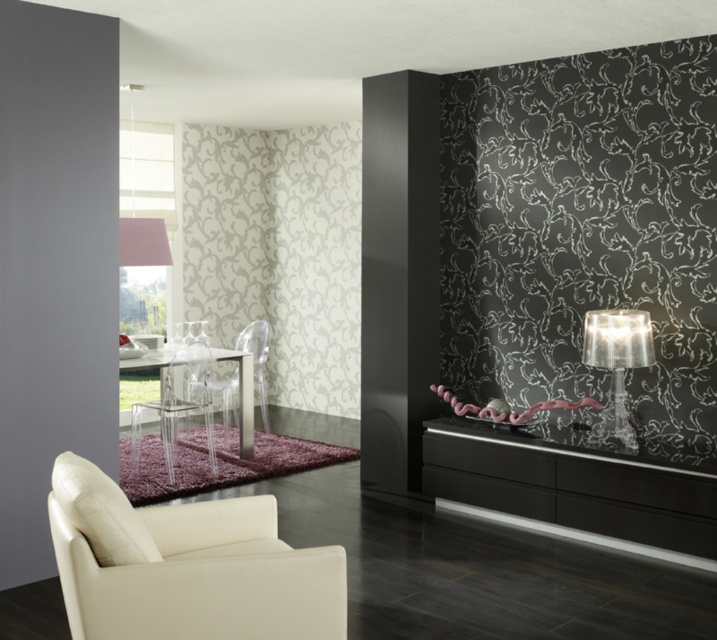
You are planning to place a new coffee table in the living room. The transparent plastic armchair at center and the white leather couch at lower left are in the way. Which furniture piece should you move first to create space for the coffee table, considering their sizes?

The transparent plastic armchair at center is bigger than the white leather couch at lower left, so you should move the transparent plastic armchair at center first to create enough space for the coffee table.

You are standing in the room and want to reach the white leather couch at lower left from your current position near the clear glass table lamp at right. Which direction should you move to get closer to the couch?

Since the clear glass table lamp at right is closer to the viewer than the white leather couch at lower left, you should move towards the left direction to approach the white leather couch at lower left.

You are a guest entering the room and need to choose a seat. The beige leather armchair at lower left and the transparent plastic chair at center are available. Which one is shorter and thus more comfortable for you to sit on?

The beige leather armchair at lower left is shorter than the transparent plastic chair at center, so it would be more comfortable for you to sit on.